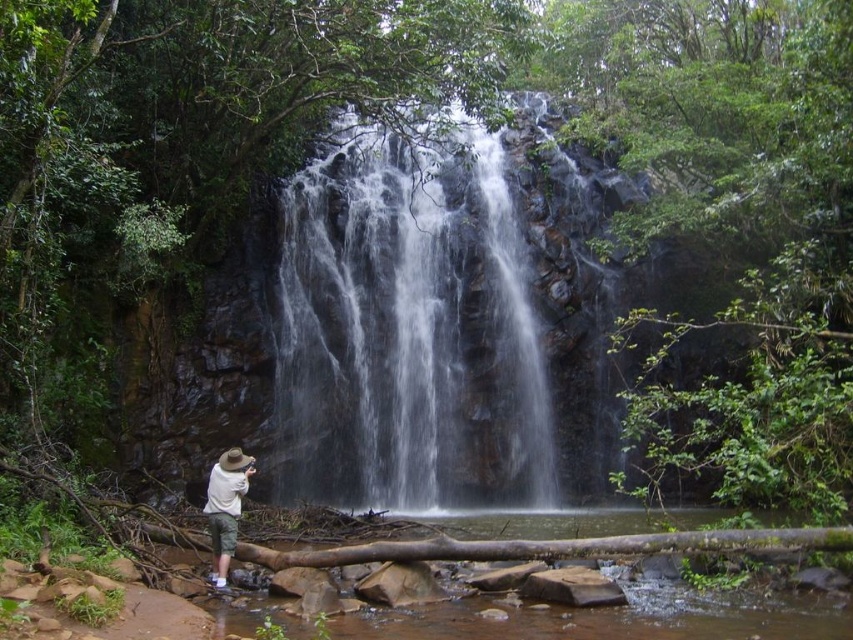
Consider the image. You are a hiker who wants to cross the stream using the fallen tree trunk. You see the clear water at center and the white cotton shirt at lower left. Which direction should you move to get to the water from the shirt?

To get to the clear water at center from the white cotton shirt at lower left, you should move to the right since the clear water at center is located to the right of the shirt.

You are a hiker who wants to cross the stream using the fallen tree trunk. The clear water at center and the white cotton shirt at lower left are visible from your position. Which object is bigger in your view?

The clear water at center is larger in size than the white cotton shirt at lower left, so the clear water at center appears bigger in your view.